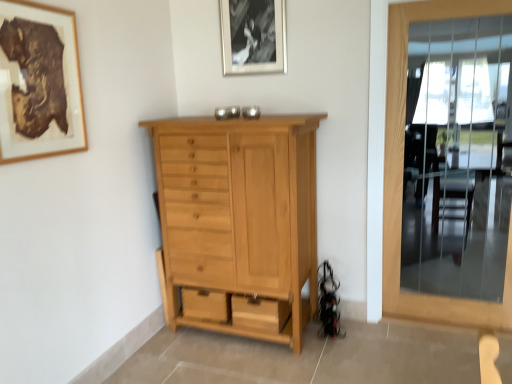
Question: In terms of height, does natural wood cabinet at center look taller or shorter compared to wooden picture frame at upper left, which ranks as the second picture frame in back-to-front order?

Choices:
 (A) short
 (B) tall

Answer: (B)

Question: Considering their positions, is natural wood cabinet at center located in front of or behind wooden picture frame at upper left, arranged as the second picture frame when viewed from the right?

Choices:
 (A) front
 (B) behind

Answer: (B)

Question: Estimate the real-world distances between objects in this image. Which object is farther from the natural wood cabinet at center?

Choices:
 (A) clear glass door at right
 (B) wooden picture frame at upper left, arranged as the second picture frame when viewed from the right
 (C) black matte picture frame at upper center, positioned as the 2th picture frame in front-to-back order

Answer: (A)

Question: Which is nearer to the black matte picture frame at upper center, positioned as the 1th picture frame in right-to-left order?

Choices:
 (A) natural wood cabinet at center
 (B) wooden picture frame at upper left, which ranks as the second picture frame in back-to-front order
 (C) clear glass door at right

Answer: (A)